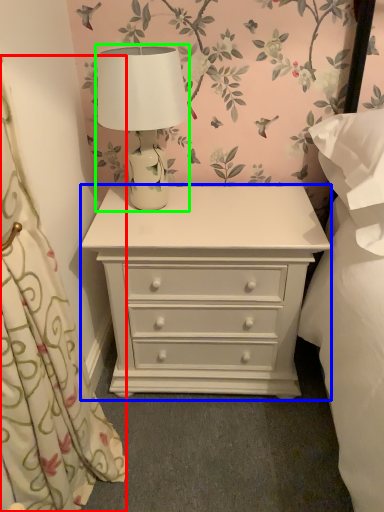
Question: Which is farther away from curtain (highlighted by a red box)? chest of drawers (highlighted by a blue box) or table lamp (highlighted by a green box)?

Choices:
 (A) chest of drawers
 (B) table lamp

Answer: (B)